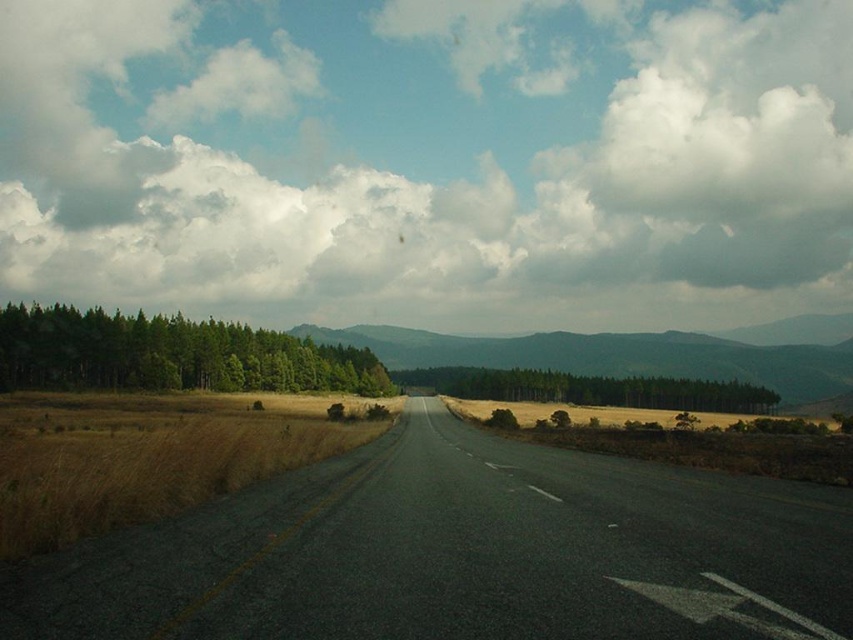
Looking at this image, you are driving a car and see two points on the road ahead. The first point is at coordinate point (386, 120) and the second is at point (651, 401). Which point is closer to your car?

Point (651, 401) is closer to your car because it is less far from the camera than point (386, 120).

You are a hiker planning to take a photo of the cloudy sky at upper center and the green forested mountain at center. Which object will occupy more of the frame in your camera view?

The cloudy sky at upper center has a larger size compared to the green forested mountain at center, so it will occupy more of the frame in your camera view.